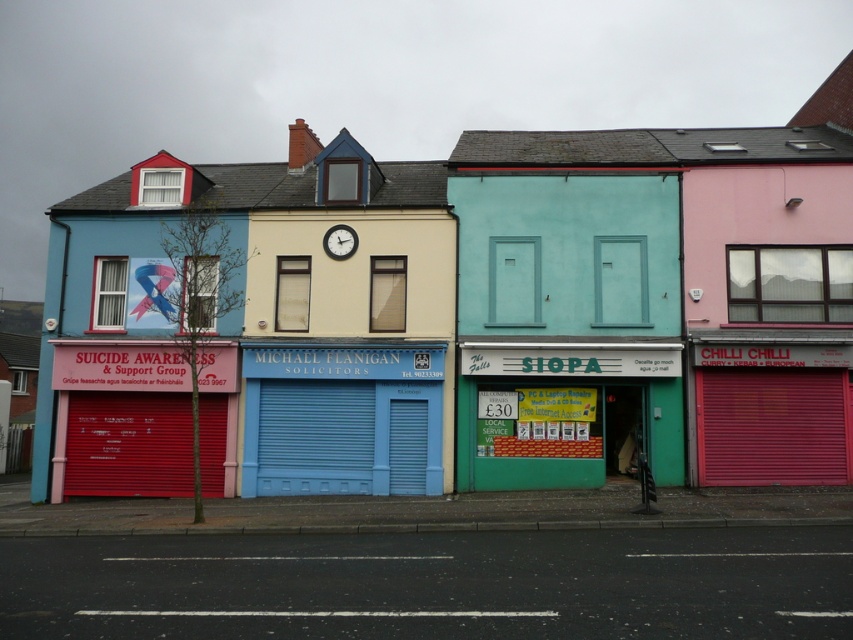
Does point (190, 296) come closer to viewer compared to point (283, 294)?

That is True.

Which is in front, point (213, 301) or point (277, 328)?

Point (277, 328) is in front.

You are a GUI agent. You are given a task and a screenshot of the screen. Output one action in this format:
    pyautogui.click(x=<x>, y=<y>)
    Task: Click on the matte plastic shutter at center
    
    Given the screenshot: What is the action you would take?
    pyautogui.click(x=199, y=292)

Does matte red garage door at right come in front of green matte door at center?

That is True.

What do you see at coordinates (772, 426) in the screenshot? Image resolution: width=853 pixels, height=640 pixels. I see `matte red garage door at right` at bounding box center [772, 426].

Find the location of a particular element. Image resolution: width=853 pixels, height=640 pixels. matte red garage door at right is located at coordinates coord(772,426).

Does point (595, 285) come closer to viewer compared to point (352, 198)?

Yes, it is in front of point (352, 198).

Between green matte door at center and blue painted shutter at center, which one is positioned lower?

Positioned lower is green matte door at center.

Is point (596, 248) more distant than point (354, 189)?

No, it is not.

Where is `green matte door at center`? The width and height of the screenshot is (853, 640). green matte door at center is located at coordinates (619, 280).